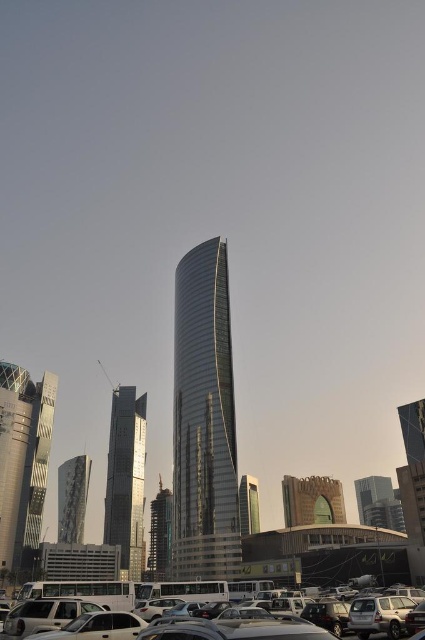
You are standing at the base of the curved skyscraper and want to walk towards the point marked at the lower right corner of the image. There are two points of interest in the scene, point (294, 492) and point (68, 477). Which point is closer to your current position?

Point (294, 492) is in front of point (68, 477), so it is closer to your current position at the base of the curved skyscraper.

You are standing in the city and want to take a photo of the brown textured building at lower center without the metallic glass skyscraper at left blocking the view. Is this possible given their positions?

The metallic glass skyscraper at left is closer to you than the brown textured building at lower center. To avoid the metallic glass skyscraper at left blocking the view, you need to position yourself so that the brown textured building at lower center is not directly behind the metallic glass skyscraper at left in your field of view.

You are standing on a street in the city and see the brown textured building at lower center and the reflective glass tower at center. Which building is closer to you?

The brown textured building at lower center is closer because it is in front of the reflective glass tower at center.